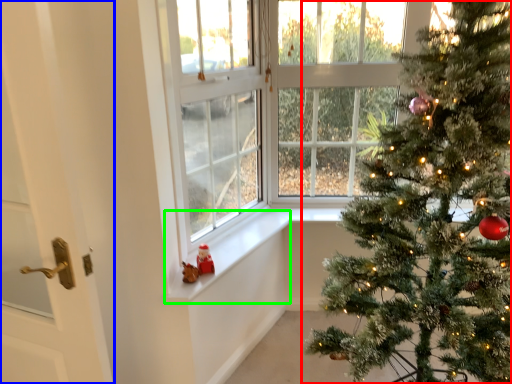
Question: Which is farther away from christmas tree (highlighted by a red box)? door (highlighted by a blue box) or window sill (highlighted by a green box)?

Choices:
 (A) door
 (B) window sill

Answer: (A)